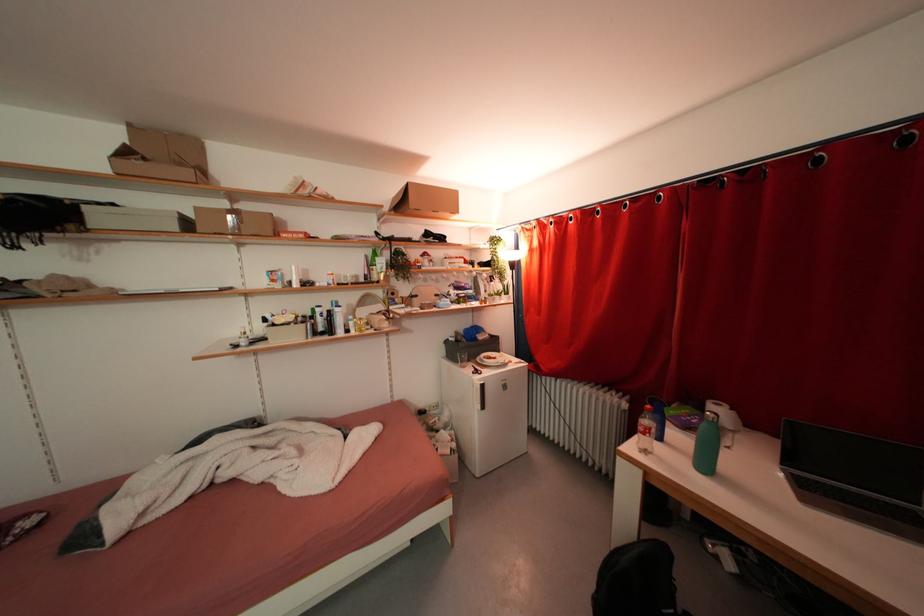
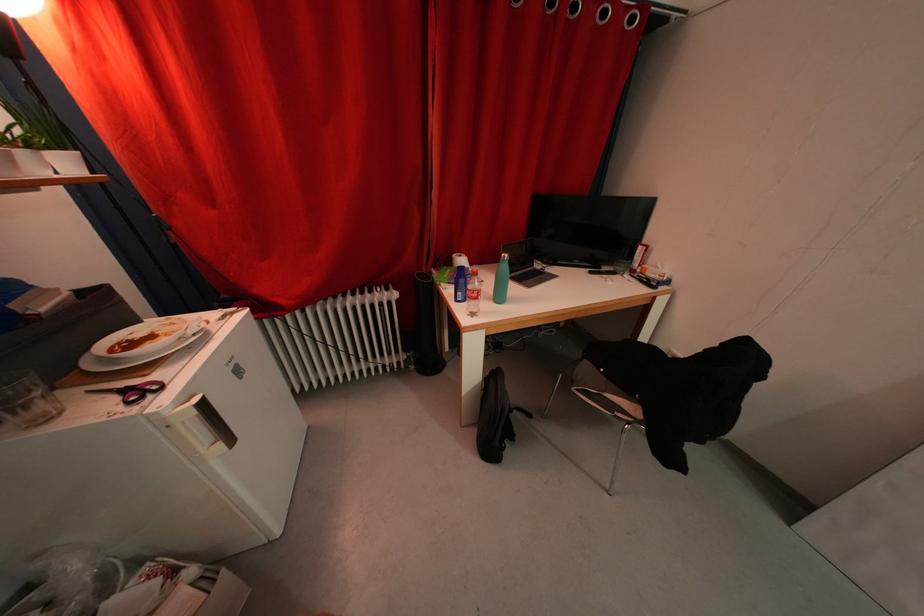
Find the pixel in the second image that matches pixel 587 389 in the first image.

(346, 302)